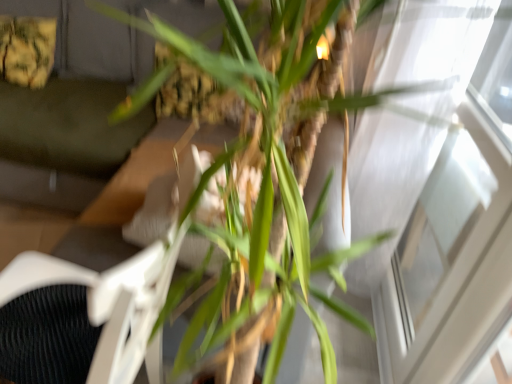
Question: Does green leafy plant at center have a larger size compared to transparent glass window at upper right?

Choices:
 (A) yes
 (B) no

Answer: (A)

Question: Can you confirm if green leafy plant at center is taller than transparent glass window at upper right?

Choices:
 (A) no
 (B) yes

Answer: (B)

Question: Is green leafy plant at center smaller than transparent glass window at upper right?

Choices:
 (A) no
 (B) yes

Answer: (A)

Question: From the image's perspective, would you say green leafy plant at center is shown under transparent glass window at upper right?

Choices:
 (A) no
 (B) yes

Answer: (B)

Question: From a real-world perspective, is green leafy plant at center below transparent glass window at upper right?

Choices:
 (A) yes
 (B) no

Answer: (B)

Question: Can you confirm if green leafy plant at center is shorter than transparent glass window at upper right?

Choices:
 (A) no
 (B) yes

Answer: (A)

Question: Is green leafy plant at center at the back of dark gray fabric couch at upper left?

Choices:
 (A) yes
 (B) no

Answer: (B)

Question: Does dark gray fabric couch at upper left have a smaller size compared to green leafy plant at center?

Choices:
 (A) no
 (B) yes

Answer: (A)

Question: Considering the relative positions of dark gray fabric couch at upper left and green leafy plant at center in the image provided, is dark gray fabric couch at upper left behind green leafy plant at center?

Choices:
 (A) yes
 (B) no

Answer: (A)

Question: Can you confirm if dark gray fabric couch at upper left is taller than green leafy plant at center?

Choices:
 (A) no
 (B) yes

Answer: (A)

Question: Is dark gray fabric couch at upper left positioned far away from green leafy plant at center?

Choices:
 (A) yes
 (B) no

Answer: (A)

Question: Considering the relative sizes of dark gray fabric couch at upper left and green leafy plant at center in the image provided, is dark gray fabric couch at upper left bigger than green leafy plant at center?

Choices:
 (A) no
 (B) yes

Answer: (B)

Question: From a real-world perspective, is white textured swivel chair at center physically above green leafy plant at center?

Choices:
 (A) yes
 (B) no

Answer: (B)